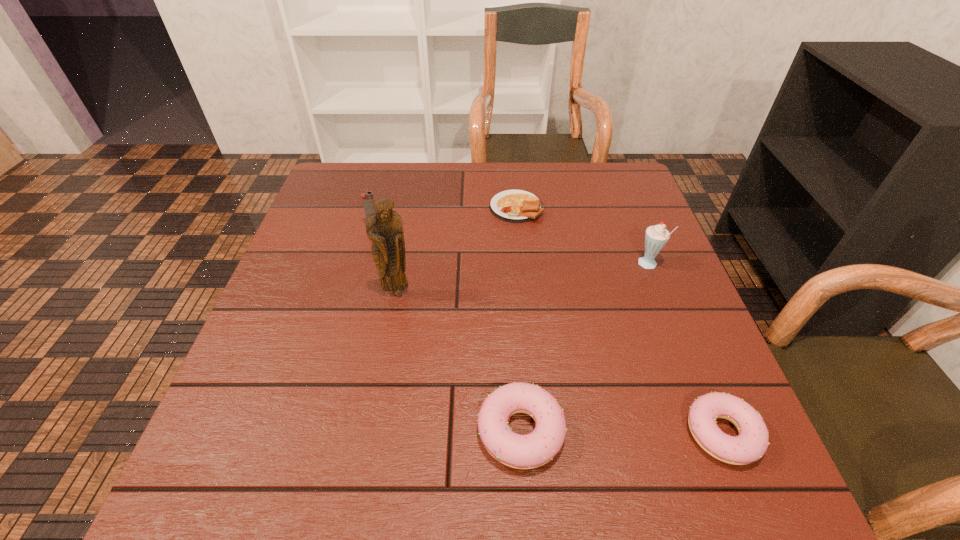
The image size is (960, 540). What are the coordinates of `object that is at the left edge` in the screenshot? It's located at (367, 198).

The height and width of the screenshot is (540, 960). Find the location of `doughnut present at the right edge`. doughnut present at the right edge is located at coordinates (750, 445).

Where is `milkshake located at the right edge`? milkshake located at the right edge is located at coordinates (656, 237).

You are a GUI agent. You are given a task and a screenshot of the screen. Output one action in this format:
    pyautogui.click(x=<x>, y=<y>)
    Task: Click on the object situated at the near right corner
    
    Given the screenshot: What is the action you would take?
    pyautogui.click(x=750, y=445)

Identify the location of free space at the far edge of the desktop. (546, 204).

In the image, there is a desktop. Where is `vacant region at the near edge`? The image size is (960, 540). vacant region at the near edge is located at coordinates (600, 421).

The width and height of the screenshot is (960, 540). In the image, there is a desktop. In order to click on vacant space at the left edge in this screenshot , I will do `click(284, 308)`.

Locate an element on the screen. The height and width of the screenshot is (540, 960). vacant space at the right edge of the desktop is located at coordinates (636, 274).

In order to click on vacant space at the far left corner in this screenshot , I will do `click(335, 191)`.

In the image, there is a desktop. What are the coordinates of `free space at the far right corner` in the screenshot? It's located at (608, 197).